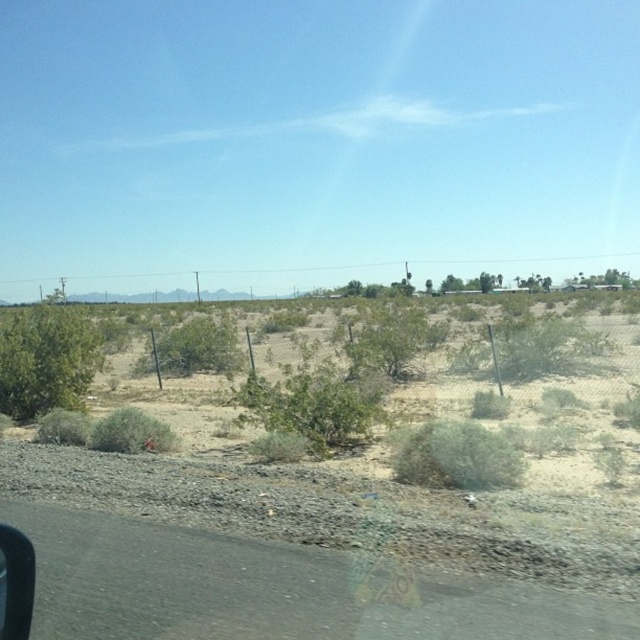
Question: Which object appears closest to the camera in this image?

Choices:
 (A) black rubber car window at lower left
 (B) green shrub at center
 (C) green leafy bush at center

Answer: (A)

Question: Is green leafy bush at center to the right of green shrub at center from the viewer's perspective?

Choices:
 (A) yes
 (B) no

Answer: (A)

Question: Among these objects, which one is nearest to the camera?

Choices:
 (A) green fuzzy bush at lower center
 (B) black rubber car window at lower left
 (C) green shrub at center
 (D) green leafy bush at center

Answer: (B)

Question: Estimate the real-world distances between objects in this image. Which object is closer to the green leafy bush at center?

Choices:
 (A) black rubber car window at lower left
 (B) green shrub at center

Answer: (A)

Question: Can you confirm if green leafy bush at center is wider than green shrub at center?

Choices:
 (A) yes
 (B) no

Answer: (B)

Question: Is green leafy bush at center below green fuzzy bush at lower center?

Choices:
 (A) no
 (B) yes

Answer: (A)